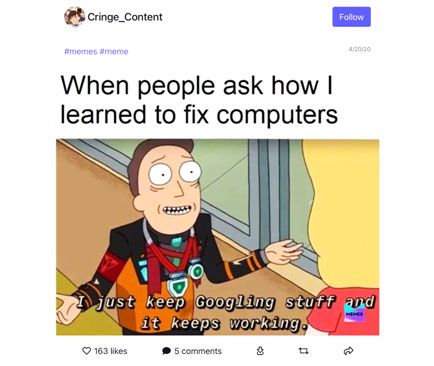
This screenshot has width=434, height=366. Find the location of `window`. window is located at coordinates (237, 193).